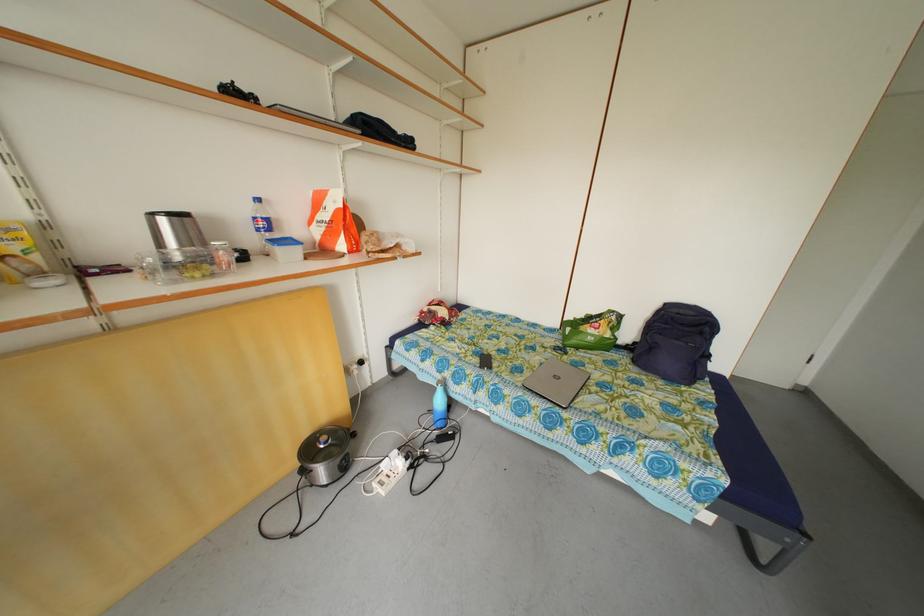
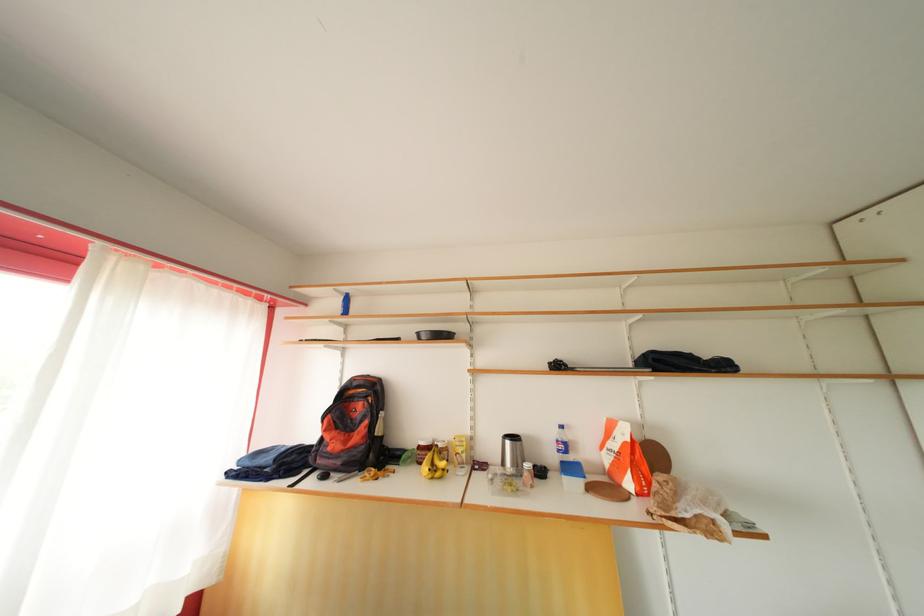
Find the pixel in the second image that matches pixel 332 222 in the first image.

(622, 451)